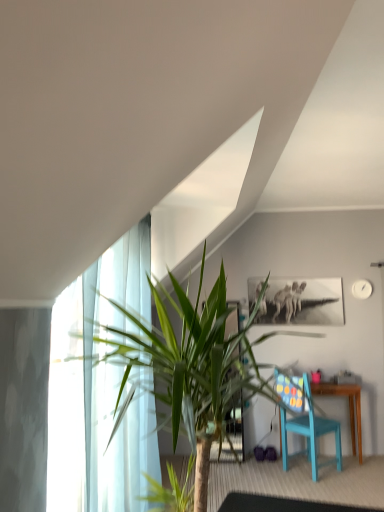
Question: Can you confirm if green leafy plant at left is thinner than matte blue chair at lower right?

Choices:
 (A) yes
 (B) no

Answer: (B)

Question: Does green leafy plant at left appear on the left side of matte blue chair at lower right?

Choices:
 (A) yes
 (B) no

Answer: (A)

Question: Are green leafy plant at left and matte blue chair at lower right making contact?

Choices:
 (A) yes
 (B) no

Answer: (B)

Question: Can you confirm if green leafy plant at left is taller than matte blue chair at lower right?

Choices:
 (A) yes
 (B) no

Answer: (A)

Question: Is green leafy plant at left in front of matte blue chair at lower right?

Choices:
 (A) yes
 (B) no

Answer: (A)

Question: Does green leafy plant at left turn towards matte blue chair at lower right?

Choices:
 (A) yes
 (B) no

Answer: (B)

Question: Could you tell me if transparent glass table at lower center is facing matte blue chair at lower right?

Choices:
 (A) yes
 (B) no

Answer: (B)

Question: Is transparent glass table at lower center positioned far away from matte blue chair at lower right?

Choices:
 (A) no
 (B) yes

Answer: (A)

Question: Does transparent glass table at lower center have a greater width compared to matte blue chair at lower right?

Choices:
 (A) yes
 (B) no

Answer: (A)

Question: From the image's perspective, is transparent glass table at lower center located above matte blue chair at lower right?

Choices:
 (A) no
 (B) yes

Answer: (A)

Question: Considering the relative sizes of transparent glass table at lower center and matte blue chair at lower right in the image provided, is transparent glass table at lower center smaller than matte blue chair at lower right?

Choices:
 (A) yes
 (B) no

Answer: (A)

Question: Does transparent glass table at lower center have a larger size compared to matte blue chair at lower right?

Choices:
 (A) no
 (B) yes

Answer: (A)

Question: Is matte blue chair at lower right outside transparent glass table at lower center?

Choices:
 (A) yes
 (B) no

Answer: (A)